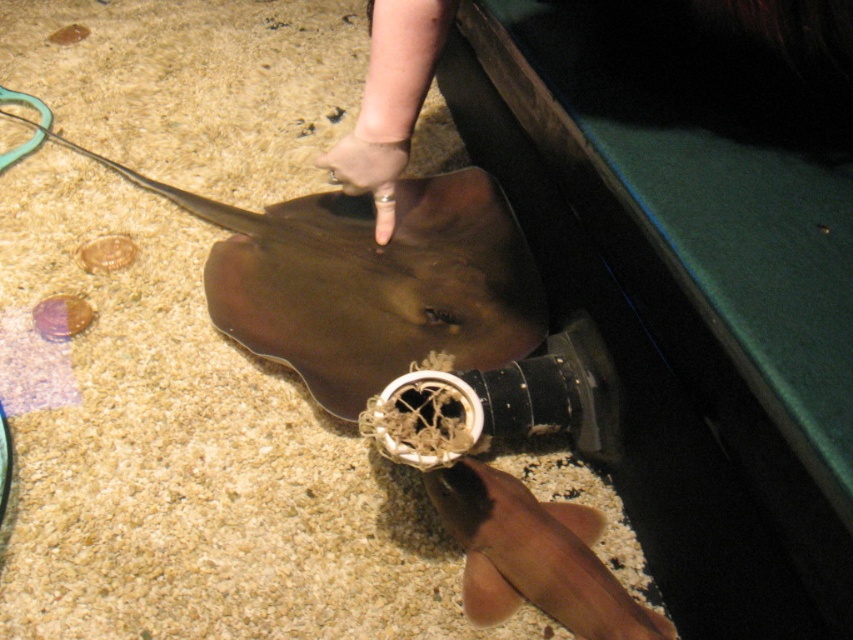
This screenshot has width=853, height=640. What do you see at coordinates (380, 285) in the screenshot?
I see `brown matte stingray at center` at bounding box center [380, 285].

Who is higher up, brown matte stingray at center or smooth brown shark at lower center?

brown matte stingray at center is higher up.

Between point (310, 212) and point (560, 529), which one is positioned behind?

The point (310, 212) is more distant.

Where is `brown matte stingray at center`? This screenshot has width=853, height=640. brown matte stingray at center is located at coordinates (380, 285).